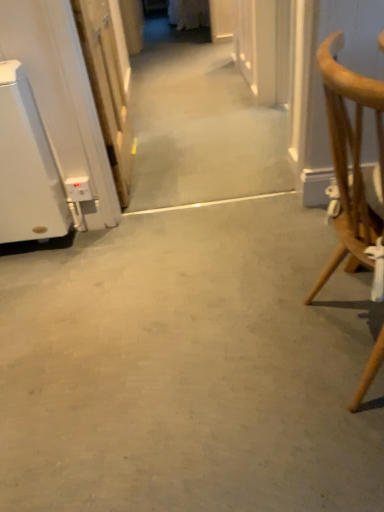
Question: Does point (339, 78) appear closer or farther from the camera than point (79, 14)?

Choices:
 (A) closer
 (B) farther

Answer: (A)

Question: In terms of width, does light brown wooden chair at right look wider or thinner when compared to white glossy door at left?

Choices:
 (A) thin
 (B) wide

Answer: (B)

Question: Estimate the real-world distances between objects in this image. Which object is closer to the gray concrete floor at center?

Choices:
 (A) white glossy door at left
 (B) light brown wooden chair at right

Answer: (B)

Question: Based on their relative distances, which object is farther from the white glossy door at left?

Choices:
 (A) gray concrete floor at center
 (B) light brown wooden chair at right

Answer: (B)